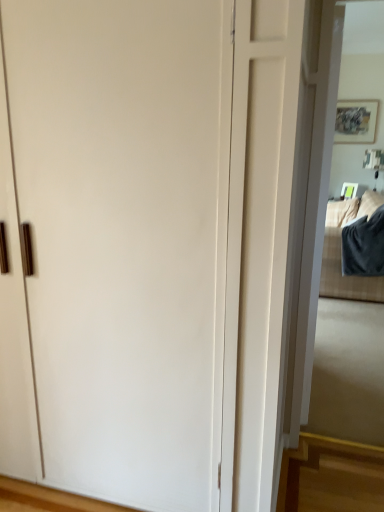
Find the location of `dark gray plush blanket at right`. dark gray plush blanket at right is located at coordinates (345, 276).

What is the approximate width of dark gray plush blanket at right?

It is 28.80 inches.

The height and width of the screenshot is (512, 384). What do you see at coordinates (345, 276) in the screenshot? I see `dark gray plush blanket at right` at bounding box center [345, 276].

Measure the distance between dark gray plush blanket at right and camera.

dark gray plush blanket at right and camera are 3.92 meters apart.

Describe the element at coordinates (347, 352) in the screenshot. I see `white glossy mirror at right` at that location.

At what (x,y) coordinates should I click in order to perform the action: click on white glossy mirror at right. Please return your answer as a coordinate pair (x, y). Image resolution: width=384 pixels, height=512 pixels. Looking at the image, I should click on (347, 352).

Image resolution: width=384 pixels, height=512 pixels. In order to click on dark gray plush blanket at right in this screenshot , I will do (345, 276).

Consider the image. Between white glossy mirror at right and dark gray plush blanket at right, which one appears on the right side from the viewer's perspective?

dark gray plush blanket at right.

Is the position of white glossy mirror at right less distant than that of dark gray plush blanket at right?

Yes, the depth of white glossy mirror at right is less than that of dark gray plush blanket at right.

Does point (357, 394) lie in front of point (329, 261)?

That is True.

From the image's perspective, is white glossy mirror at right above dark gray plush blanket at right?

Incorrect, from the image's perspective, white glossy mirror at right is lower than dark gray plush blanket at right.

From a real-world perspective, does white glossy mirror at right stand above dark gray plush blanket at right?

Yes, from a real-world perspective, white glossy mirror at right is over dark gray plush blanket at right

Can you confirm if white glossy mirror at right is wider than dark gray plush blanket at right?

In fact, white glossy mirror at right might be narrower than dark gray plush blanket at right.

Between white glossy mirror at right and dark gray plush blanket at right, which one has more height?

With more height is white glossy mirror at right.

Who is bigger, white glossy mirror at right or dark gray plush blanket at right?

dark gray plush blanket at right.

Is white glossy mirror at right inside the boundaries of dark gray plush blanket at right, or outside?

white glossy mirror at right cannot be found inside dark gray plush blanket at right.

Does white glossy mirror at right touch dark gray plush blanket at right?

white glossy mirror at right and dark gray plush blanket at right are not in contact.

Is dark gray plush blanket at right at the back of white glossy mirror at right?

No, white glossy mirror at right is not facing away from dark gray plush blanket at right.

Can you tell me how much white glossy mirror at right and dark gray plush blanket at right differ in facing direction?

The angular difference between white glossy mirror at right and dark gray plush blanket at right is 168 degrees.

How much distance is there between white glossy mirror at right and dark gray plush blanket at right?

The distance of white glossy mirror at right from dark gray plush blanket at right is 10.32 feet.

The image size is (384, 512). Identify the location of mirror in front of the dark gray plush blanket at right. (347, 352).

Would you say dark gray plush blanket at right is to the left or to the right of white glossy mirror at right in the picture?

dark gray plush blanket at right is positioned on white glossy mirror at right's right side.

Between dark gray plush blanket at right and white glossy mirror at right, which one is positioned in front?

white glossy mirror at right is closer to the camera.

Is point (326, 266) more distant than point (328, 433)?

That is True.

From the image's perspective, which object appears higher, dark gray plush blanket at right or white glossy mirror at right?

dark gray plush blanket at right appears higher in the image.

From a real-world perspective, which object rests below the other?

dark gray plush blanket at right is physically lower.

Is dark gray plush blanket at right wider than white glossy mirror at right?

Yes, dark gray plush blanket at right is wider than white glossy mirror at right.

Considering the sizes of objects dark gray plush blanket at right and white glossy mirror at right in the image provided, who is taller, dark gray plush blanket at right or white glossy mirror at right?

white glossy mirror at right.

Which of these two, dark gray plush blanket at right or white glossy mirror at right, is smaller?

Smaller between the two is white glossy mirror at right.

Based on the photo, is dark gray plush blanket at right not inside white glossy mirror at right?

That's correct, dark gray plush blanket at right is outside of white glossy mirror at right.

Is the surface of dark gray plush blanket at right in direct contact with white glossy mirror at right?

No.

Could you tell me if dark gray plush blanket at right is turned towards white glossy mirror at right?

No, dark gray plush blanket at right is not facing towards white glossy mirror at right.

How many degrees apart are the facing directions of dark gray plush blanket at right and white glossy mirror at right?

There is a 168-degree angle between the facing directions of dark gray plush blanket at right and white glossy mirror at right.

Where is `bedding that appears below the white glossy mirror at right (from a real-world perspective)`? Image resolution: width=384 pixels, height=512 pixels. bedding that appears below the white glossy mirror at right (from a real-world perspective) is located at coordinates (345, 276).

Locate an element on the screen. The height and width of the screenshot is (512, 384). bedding behind the white glossy mirror at right is located at coordinates (345, 276).

This screenshot has height=512, width=384. What are the coordinates of `mirror that is on the left side of dark gray plush blanket at right` in the screenshot? It's located at (347, 352).